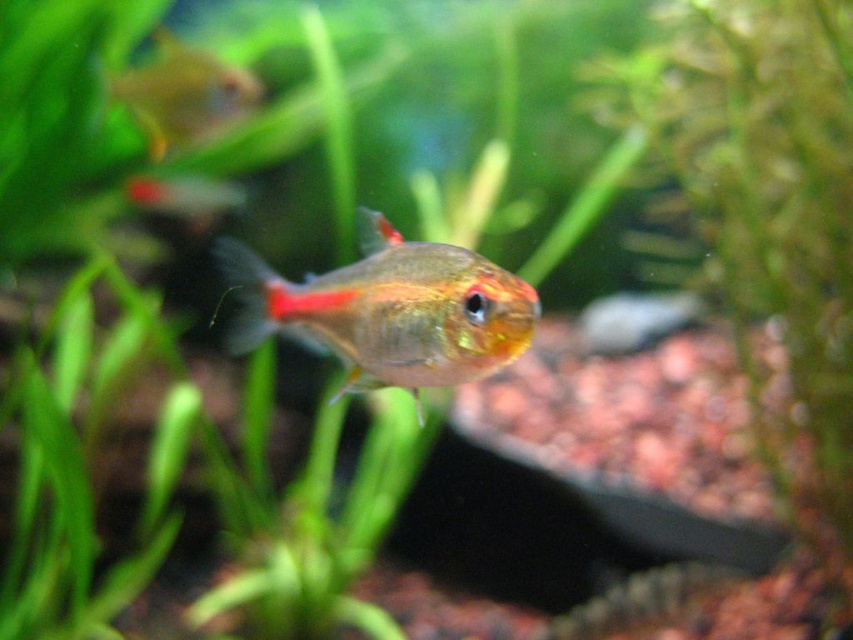
Question: Does translucent glass fish at center have a larger size compared to translucent glass fish at upper left?

Choices:
 (A) yes
 (B) no

Answer: (B)

Question: Is translucent glass fish at center positioned in front of translucent glass fish at upper left?

Choices:
 (A) no
 (B) yes

Answer: (B)

Question: Which point is farther to the camera?

Choices:
 (A) translucent glass fish at upper left
 (B) translucent glass fish at center

Answer: (A)

Question: Does translucent glass fish at center have a greater width compared to translucent glass fish at upper left?

Choices:
 (A) no
 (B) yes

Answer: (B)

Question: Which point is farther from the camera taking this photo?

Choices:
 (A) (212, 64)
 (B) (258, 278)

Answer: (A)